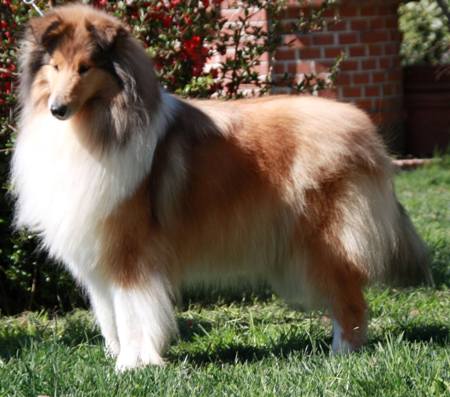
The height and width of the screenshot is (397, 450). In order to click on brick wall in this screenshot , I will do `click(354, 58)`.